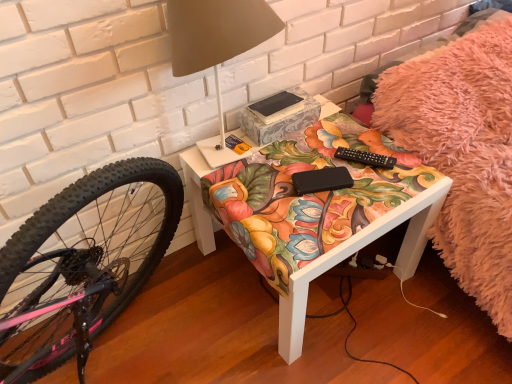
You are a GUI agent. You are given a task and a screenshot of the screen. Output one action in this format:
    pyautogui.click(x=<x>, y=<y>)
    Task: Click on the vacant location below matte white table lamp at upper center (from a real-world perspective)
    This screenshot has height=384, width=512.
    Given the screenshot: What is the action you would take?
    (242, 165)